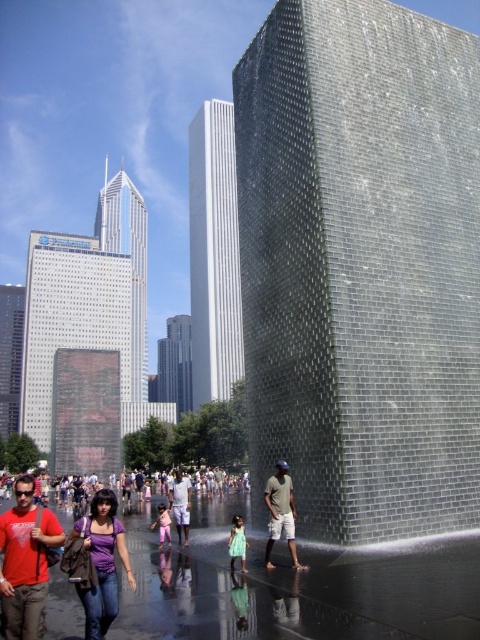
Question: Which object is positioned closest to the matte red t-shirt at center?

Choices:
 (A) light purple shirt at center
 (B) pink fabric dress at center
 (C) matte green t-shirt at center
 (D) teal fabric dress at center

Answer: (D)

Question: Which of these objects is positioned closest to the matte green t-shirt at center?

Choices:
 (A) matte red t-shirt at center
 (B) teal fabric dress at center
 (C) purple matte shirt at center
 (D) pink fabric dress at center

Answer: (B)

Question: Among these objects, which one is farthest from the camera?

Choices:
 (A) teal fabric dress at center
 (B) matte red t-shirt at center

Answer: (A)

Question: Does matte red t-shirt at center have a larger size compared to matte green t-shirt at center?

Choices:
 (A) yes
 (B) no

Answer: (A)

Question: Observing the image, what is the correct spatial positioning of purple matte shirt at center in reference to matte green t-shirt at center?

Choices:
 (A) right
 (B) left

Answer: (B)

Question: Can you confirm if purple matte shirt at center is smaller than pink fabric dress at center?

Choices:
 (A) no
 (B) yes

Answer: (A)